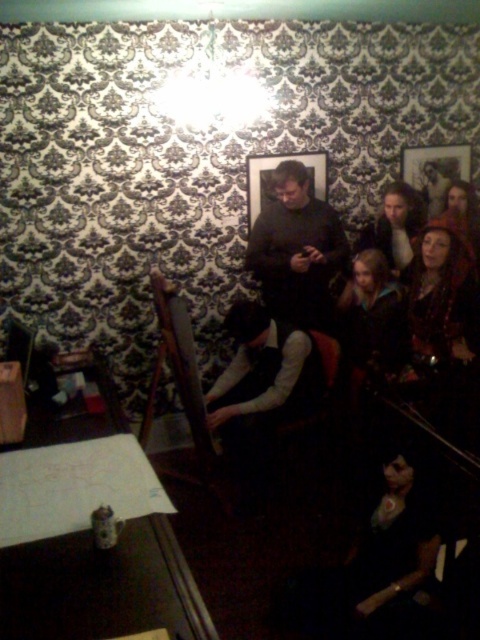
You are an interior designer planning to place a new decorative item on the table. The dark gray sweater at center and the wooden picture frame at upper right are already there. Which object should you move to accommodate the new item if the sweater takes up more space?

The dark gray sweater at center should be moved because its width is larger than the wooden picture frame at upper right, meaning it occupies more space on the table.

You are standing in the room and see two points marked on the wall. The first point is at coordinates point (285,177) and the second point is at point (422,182). Which point is closer to you?

Point (285,177) is in front of point (422,182), so it is closer to you.